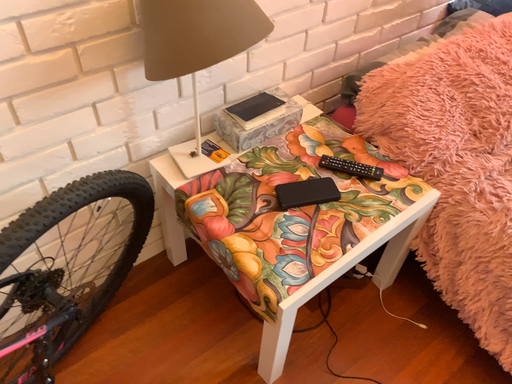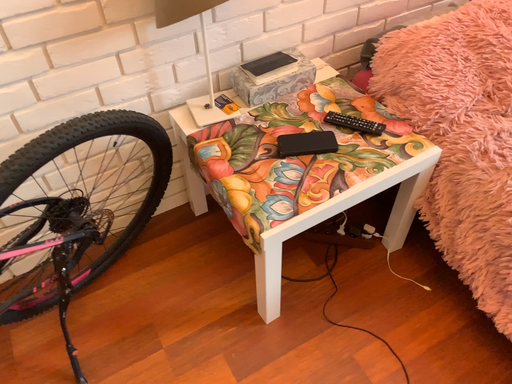
Question: Which way did the camera rotate in the video?

Choices:
 (A) rotated left
 (B) rotated right

Answer: (A)